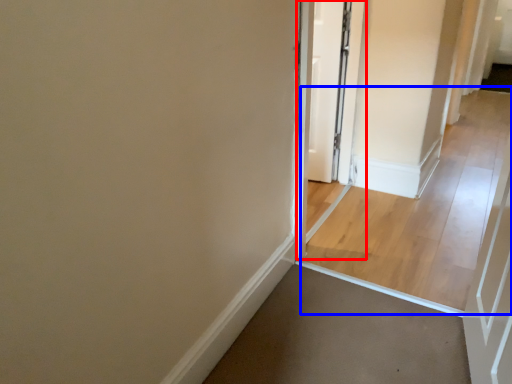
Question: Which object appears farthest to the camera in this image, screen door (highlighted by a red box) or path (highlighted by a blue box)?

Choices:
 (A) screen door
 (B) path

Answer: (B)